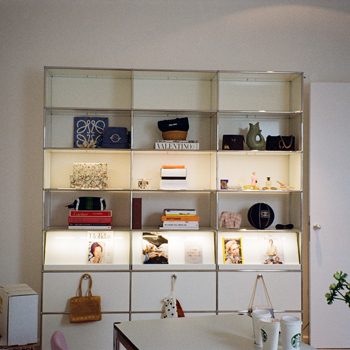
At what (x,y) coordinates should I click in order to perform the action: click on cardboard box. Please return your answer as a coordinate pair (x, y). The image size is (350, 350). Looking at the image, I should click on (26, 313).